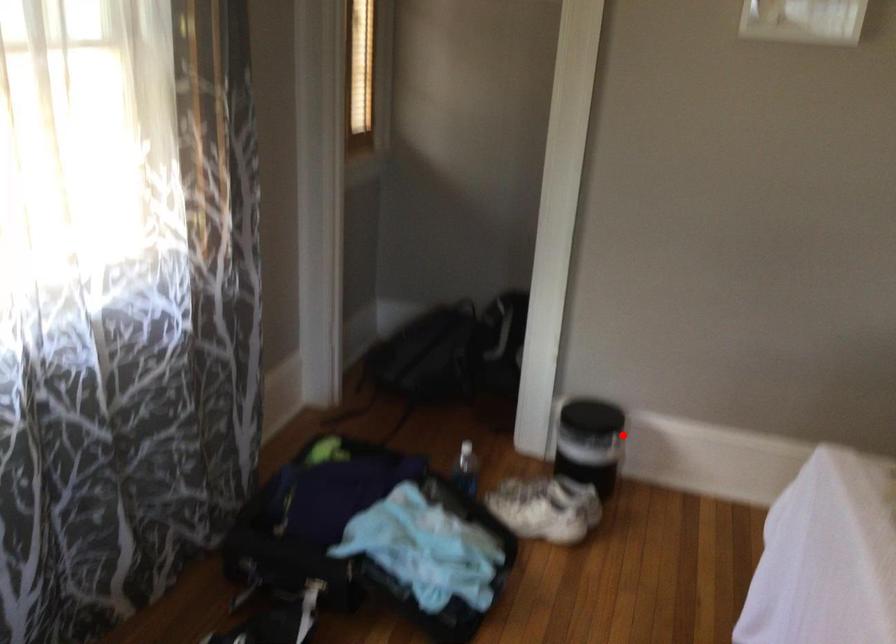
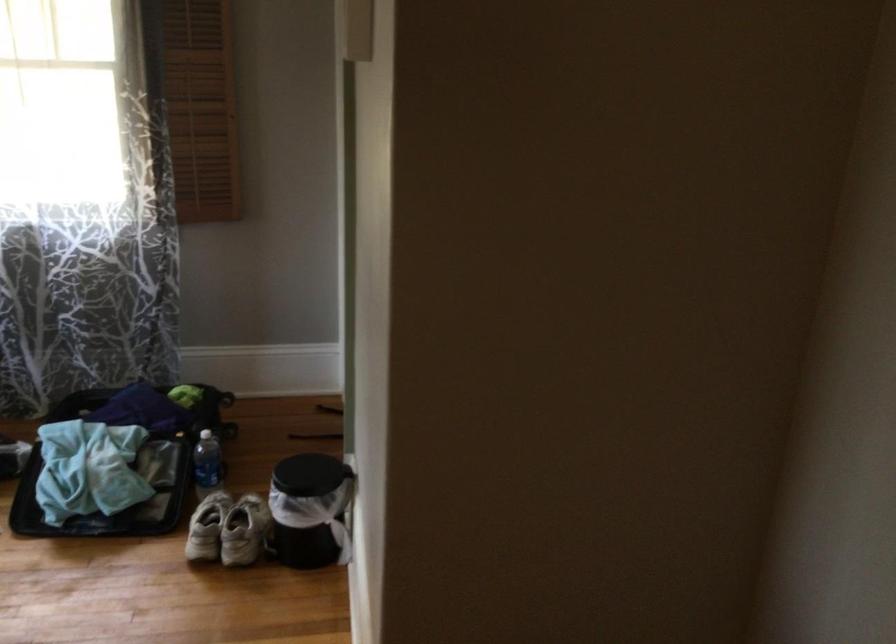
Question: I am providing you with two images of the same scene from different viewpoints. Image1 has a red point marked. In image2, the corresponding 3D location appears at what relative position? Reply with the corresponding letter.

Choices:
 (A) Closer
 (B) Farther

Answer: (A)